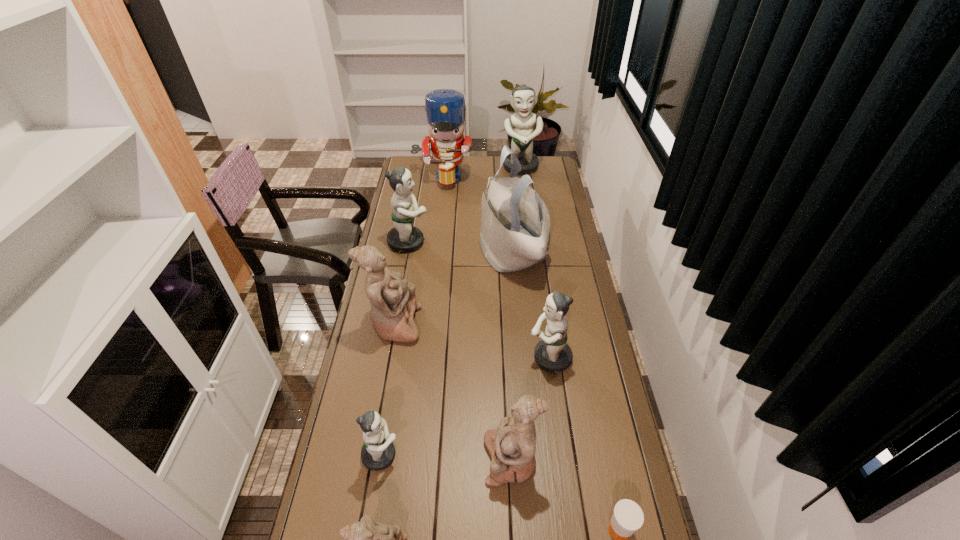
The height and width of the screenshot is (540, 960). What are the coordinates of `free space at the right edge of the desktop` in the screenshot? It's located at (572, 284).

The width and height of the screenshot is (960, 540). In the image, there is a desktop. Find the location of `blank space at the far right corner`. blank space at the far right corner is located at coordinates (549, 166).

This screenshot has height=540, width=960. I want to click on vacant area that lies between the shopping bag and the third smallest green figurine, so (461, 246).

Identify the location of free point between the biggest white figurine and the nutcracker. (419, 251).

The width and height of the screenshot is (960, 540). I want to click on free spot between the biggest white figurine and the second nearest green figurine, so click(472, 341).

Image resolution: width=960 pixels, height=540 pixels. What are the coordinates of `empty space that is in between the shopping bag and the second smallest green figurine` in the screenshot? It's located at (531, 305).

Locate which object is the ninth closest to the shopping bag. Please provide its 2D coordinates. Your answer should be formatted as a tuple, i.e. [(x, y)], where the tuple contains the x and y coordinates of a point satisfying the conditions above.

[(367, 539)]

Locate an element on the screen. object identified as the sixth closest to the shortest object is located at coordinates (515, 231).

What are the coordinates of `figurine that can be found as the third closest to the nutcracker` in the screenshot? It's located at (393, 302).

You are a GUI agent. You are given a task and a screenshot of the screen. Output one action in this format:
    pyautogui.click(x=<x>, y=<y>)
    Task: Click on the seventh closest figurine to the shopping bag
    
    Given the screenshot: What is the action you would take?
    pyautogui.click(x=367, y=539)